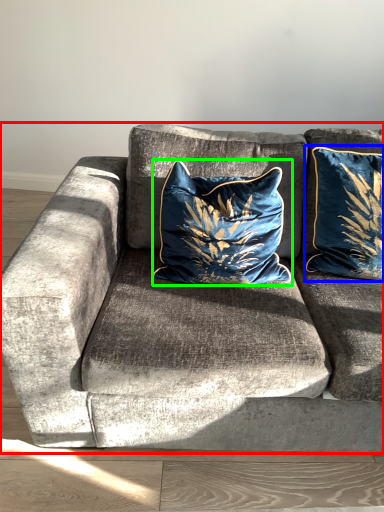
Question: Which object is positioned closest to studio couch (highlighted by a red box)? Select from pillow (highlighted by a blue box) and pillow (highlighted by a green box).

Choices:
 (A) pillow
 (B) pillow

Answer: (B)